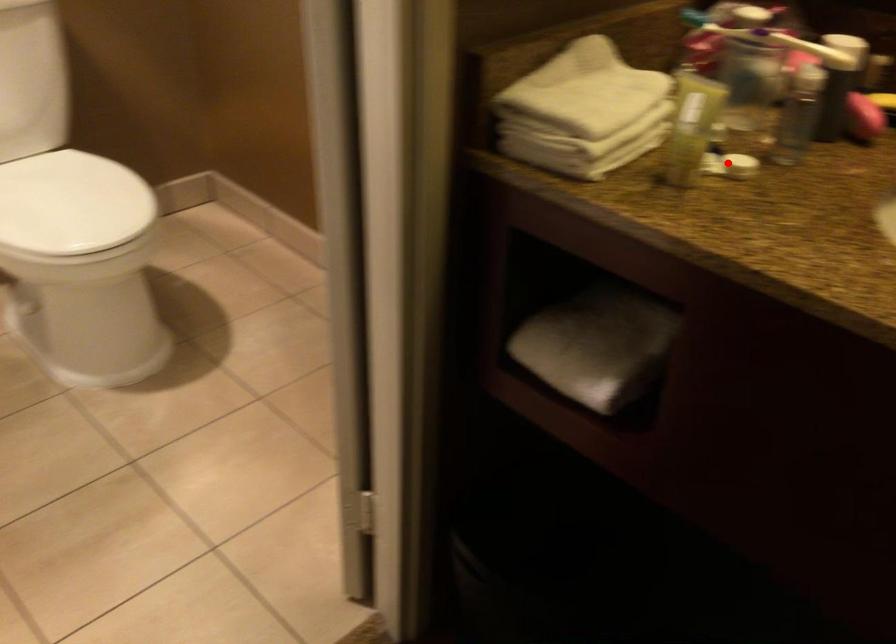
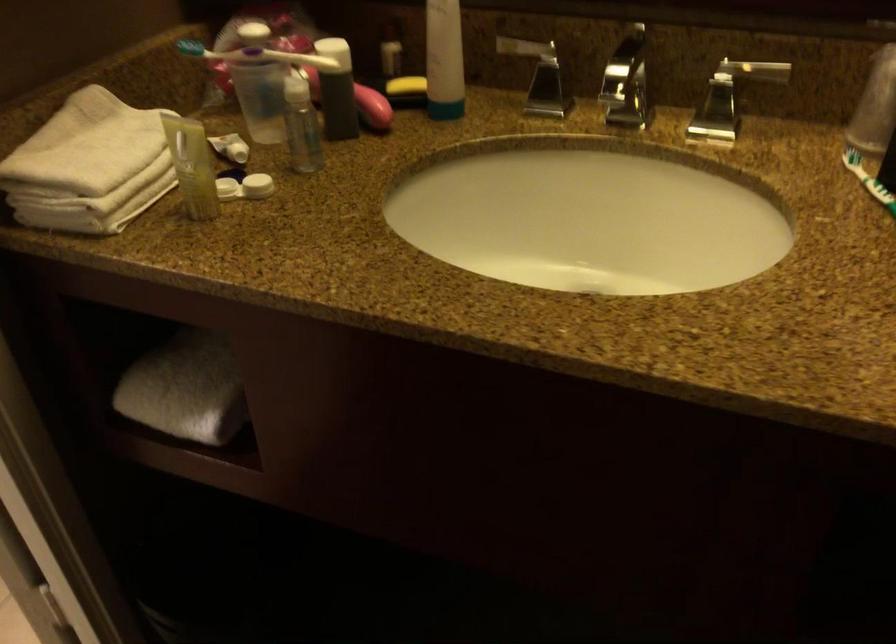
Where in the second image is the point corresponding to the highlighted location from the first image?

(245, 187)